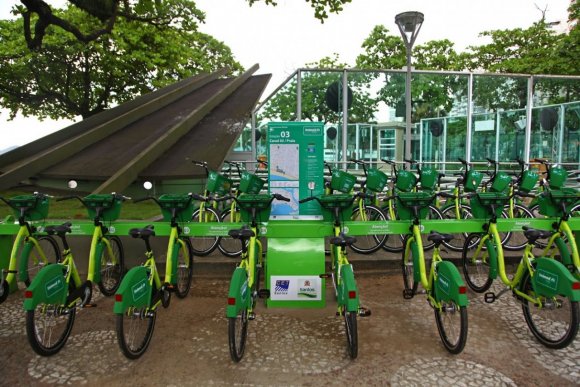
This screenshot has height=387, width=580. In order to click on seats in the first row in this screenshot , I will do `click(58, 228)`, `click(142, 234)`, `click(240, 234)`, `click(339, 236)`, `click(435, 235)`, `click(535, 231)`.